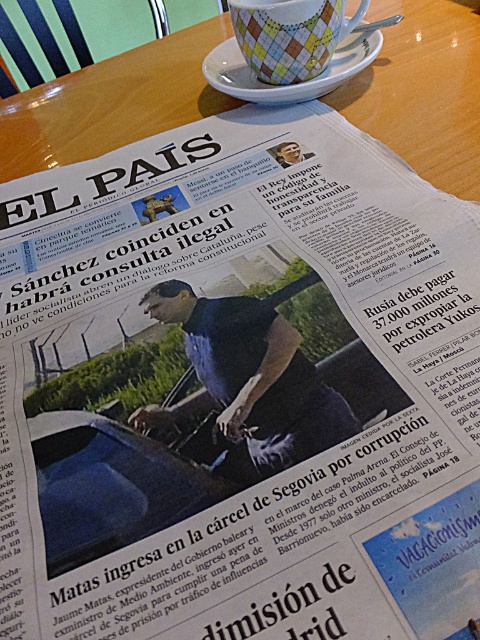
You are standing in a room and see the wooden table at center. Can you determine its exact location based on the coordinates provided?

The wooden table at center is located at point (111, 102).

You are a photographer standing at the camera position. The wooden table at center has a newspaper spread open on it. If you want to take a photo of the newspaper without moving the camera, can you capture the entire newspaper in the frame?

The wooden table at center and camera are 15.91 inches apart from each other. Since the camera is positioned close to the table, it is likely that the entire newspaper can be captured in the frame without moving the camera.

You are a photographer who needs to place a camera on the wooden table at center so it doesn t fall off. Considering the white ceramic saucer at upper center is already there, what should you do to ensure the camera stays stable?

The wooden table at center has a greater height compared to the white ceramic saucer at upper center. To ensure the camera stays stable, place it on the wooden table at center away from the edge, ensuring it doesn t overhang the saucer or the table s edge.